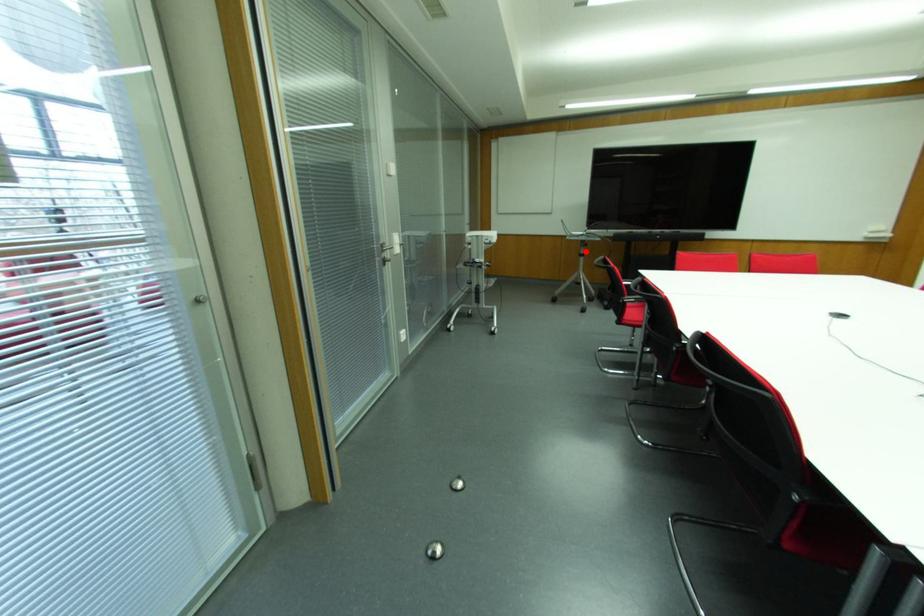
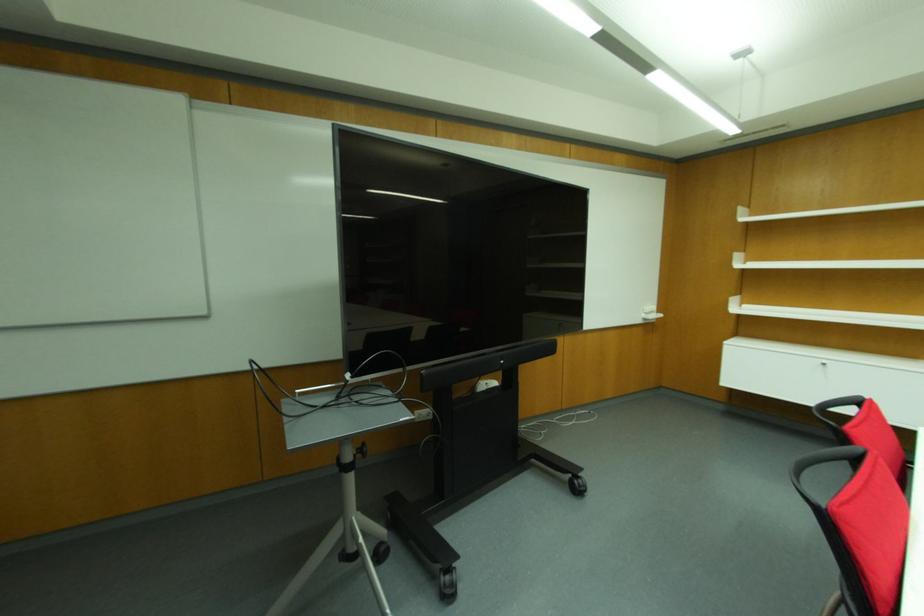
Question: I am providing you with two images of the same scene from different viewpoints. A red point is shown in image1. For the corresponding object point in image2, is it positioned nearer or farther from the camera?

Choices:
 (A) Nearer
 (B) Farther

Answer: (B)